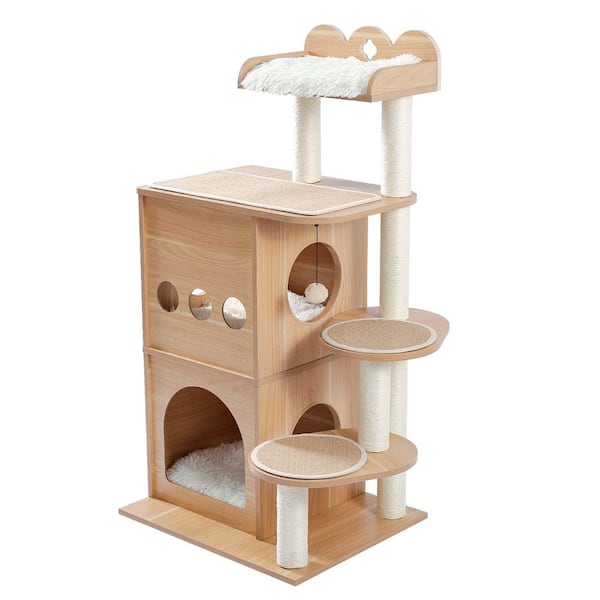
You are a GUI agent. You are given a task and a screenshot of the screen. Output one action in this format:
    pyautogui.click(x=<x>, y=<y>)
    Task: Click on the middle cushion
    This screenshot has width=600, height=600.
    Given the screenshot: What is the action you would take?
    pyautogui.click(x=297, y=306)